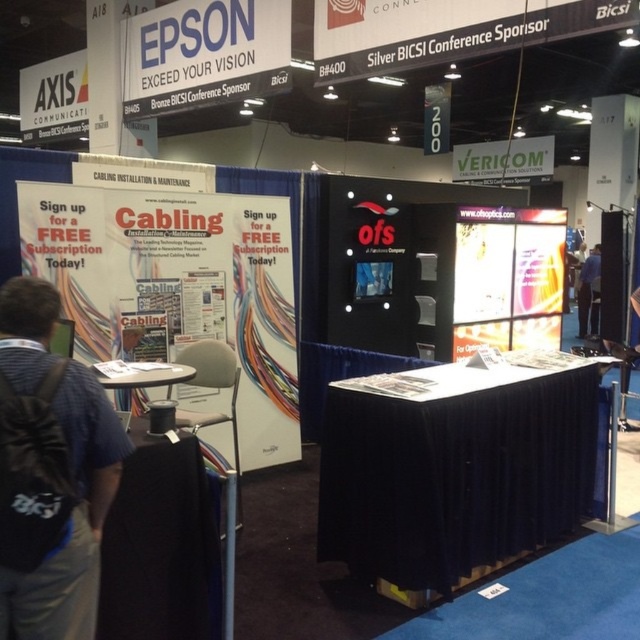
Is black fabric table at center thinner than blue fabric at right?

In fact, black fabric table at center might be wider than blue fabric at right.

Who is higher up, black fabric table at center or blue fabric at right?

blue fabric at right

Which is in front, point (412, 388) or point (595, 298)?

Point (412, 388) is more forward.

The height and width of the screenshot is (640, 640). I want to click on black fabric table at center, so click(x=452, y=472).

Who is shorter, black fabric table at center or green matte sign at upper center?

Standing shorter between the two is black fabric table at center.

Consider the image. Is black fabric table at center thinner than green matte sign at upper center?

Yes.

This screenshot has height=640, width=640. Identify the location of black fabric table at center. (452, 472).

Is white paperboard at upper left shorter than green matte sign at upper center?

Incorrect, white paperboard at upper left's height does not fall short of green matte sign at upper center's.

Which is in front, point (144, 20) or point (528, 180)?

Point (144, 20) is in front.

Find the location of `white paperboard at upper left`. white paperboard at upper left is located at coordinates (204, 54).